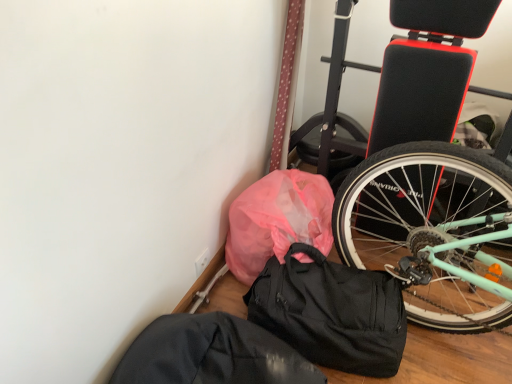
What do you see at coordinates (211, 354) in the screenshot?
I see `black fabric sack at lower center` at bounding box center [211, 354].

This screenshot has height=384, width=512. What do you see at coordinates (332, 312) in the screenshot? I see `black matte duffel bag at lower center` at bounding box center [332, 312].

Identify the location of black fabric sack at lower center. This screenshot has height=384, width=512. (211, 354).

Locate an element on the screen. Image resolution: width=512 pixels, height=384 pixels. material above the black fabric sack at lower center (from the image's perspective) is located at coordinates (277, 220).

Choose the correct answer: Is pink plastic bag at lower left inside black fabric sack at lower center or outside it?

pink plastic bag at lower left exists outside the volume of black fabric sack at lower center.

Can you confirm if pink plastic bag at lower left is smaller than black fabric sack at lower center?

No, pink plastic bag at lower left is not smaller than black fabric sack at lower center.

Is black fabric sack at lower center next to pink plastic bag at lower left?

No, black fabric sack at lower center is not next to pink plastic bag at lower left.

Considering the sizes of objects black fabric sack at lower center and pink plastic bag at lower left in the image provided, who is smaller, black fabric sack at lower center or pink plastic bag at lower left?

black fabric sack at lower center.

Image resolution: width=512 pixels, height=384 pixels. I want to click on material located on the right of black fabric sack at lower center, so click(x=277, y=220).

Considering their positions, is black fabric sack at lower center located in front of or behind pink plastic bag at lower left?

Visually, black fabric sack at lower center is located in front of pink plastic bag at lower left.

Which point is more forward, [249,244] or [401,303]?

The point [401,303] is more forward.

In the scene shown: Who is shorter, pink plastic bag at lower left or black matte duffel bag at lower center?

With less height is black matte duffel bag at lower center.

Which object is further away from the camera, pink plastic bag at lower left or black matte duffel bag at lower center?

pink plastic bag at lower left is behind.

The height and width of the screenshot is (384, 512). In order to click on material on the left of black matte duffel bag at lower center in this screenshot , I will do `click(277, 220)`.

Considering the positions of objects black matte duffel bag at lower center and pink plastic bag at lower left in the image provided, who is more to the right, black matte duffel bag at lower center or pink plastic bag at lower left?

From the viewer's perspective, black matte duffel bag at lower center appears more on the right side.

Which of these two, black matte duffel bag at lower center or pink plastic bag at lower left, is wider?

black matte duffel bag at lower center.

Is point (291, 290) closer or farther from the camera than point (260, 195)?

Point (291, 290) is closer to the camera than point (260, 195).

Which is behind, black matte duffel bag at lower center or pink plastic bag at lower left?

pink plastic bag at lower left is further away from the camera.

Is black matte duffel bag at lower center thinner than black fabric sack at lower center?

Indeed, black matte duffel bag at lower center has a lesser width compared to black fabric sack at lower center.

How different are the orientations of black matte duffel bag at lower center and black fabric sack at lower center in degrees?

The angle between the facing direction of black matte duffel bag at lower center and the facing direction of black fabric sack at lower center is 1.04e-05 degrees.

From the image's perspective, is black matte duffel bag at lower center beneath black fabric sack at lower center?

Actually, black matte duffel bag at lower center appears above black fabric sack at lower center in the image.

Does black matte duffel bag at lower center have a greater height compared to black fabric sack at lower center?

Yes.

Is black fabric sack at lower center facing towards black matte duffel bag at lower center?

No, black fabric sack at lower center is not turned towards black matte duffel bag at lower center.

Would you say black fabric sack at lower center is a long distance from black matte duffel bag at lower center?

black fabric sack at lower center is actually quite close to black matte duffel bag at lower center.

Is black fabric sack at lower center wider than black matte duffel bag at lower center?

Correct, the width of black fabric sack at lower center exceeds that of black matte duffel bag at lower center.

Where is `luggage and bags located underneath the black fabric sack at lower center (from a real-world perspective)`? luggage and bags located underneath the black fabric sack at lower center (from a real-world perspective) is located at coordinates (332, 312).

Find the location of a particular element. The height and width of the screenshot is (384, 512). sack in front of the pink plastic bag at lower left is located at coordinates (211, 354).

The image size is (512, 384). What are the coordinates of `material behind the black fabric sack at lower center` in the screenshot? It's located at (277, 220).

Based on their spatial positions, is pink plastic bag at lower left or black matte duffel bag at lower center further from black fabric sack at lower center?

pink plastic bag at lower left.

Looking at the image, which one is located closer to black fabric sack at lower center, black matte duffel bag at lower center or pink plastic bag at lower left?

Based on the image, black matte duffel bag at lower center appears to be nearer to black fabric sack at lower center.

Considering their positions, is black fabric sack at lower center positioned closer to black matte duffel bag at lower center than pink plastic bag at lower left?

pink plastic bag at lower left is positioned closer to the anchor black matte duffel bag at lower center.

Which object lies further to the anchor point pink plastic bag at lower left, black fabric sack at lower center or black matte duffel bag at lower center?

The object further to pink plastic bag at lower left is black fabric sack at lower center.

From the image, which object appears to be farther from pink plastic bag at lower left, black matte duffel bag at lower center or black fabric sack at lower center?

The object further to pink plastic bag at lower left is black fabric sack at lower center.

Considering their positions, is pink plastic bag at lower left positioned further to black matte duffel bag at lower center than black fabric sack at lower center?

black fabric sack at lower center.

Find the location of a particular element. luggage and bags between pink plastic bag at lower left and black fabric sack at lower center vertically is located at coordinates tap(332, 312).